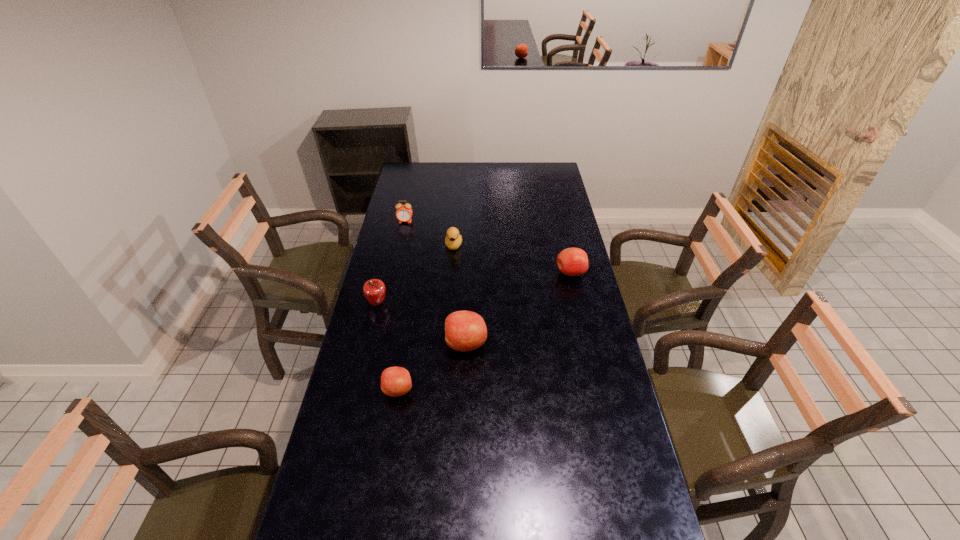
The width and height of the screenshot is (960, 540). In order to click on the third apple from right to left in this screenshot , I will do `click(395, 381)`.

The height and width of the screenshot is (540, 960). Find the location of `the shortest apple`. the shortest apple is located at coordinates [395, 381].

Locate an element on the screen. The width and height of the screenshot is (960, 540). the second nearest object is located at coordinates (464, 330).

At what (x,y) coordinates should I click in order to perform the action: click on the second apple from right to left. Please return your answer as a coordinate pair (x, y). Looking at the image, I should click on (464, 330).

This screenshot has height=540, width=960. Find the location of `the third farthest object`. the third farthest object is located at coordinates [572, 261].

The image size is (960, 540). I want to click on the farthest apple, so click(572, 261).

Where is `the leftmost apple`? The image size is (960, 540). the leftmost apple is located at coordinates (374, 290).

Find the location of a particular element. This screenshot has height=540, width=960. the third nearest object is located at coordinates (374, 290).

At what (x,y) coordinates should I click in order to perform the action: click on the fifth nearest object. Please return your answer as a coordinate pair (x, y). Looking at the image, I should click on (453, 240).

This screenshot has width=960, height=540. In order to click on alarm clock in this screenshot , I will do `click(404, 212)`.